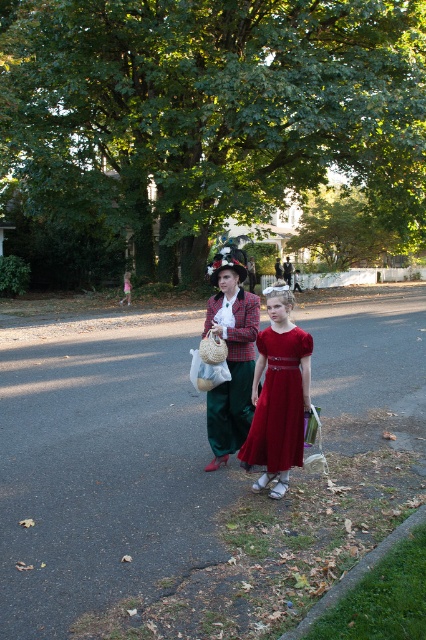
Question: Based on their relative distances, which object is nearer to the shiny satin dress at center?

Choices:
 (A) matte plaid coat at center
 (B) pink satin dress at center

Answer: (A)

Question: Is matte plaid coat at center positioned behind shiny satin dress at center?

Choices:
 (A) no
 (B) yes

Answer: (B)

Question: Which point is closer to the camera taking this photo?

Choices:
 (A) (278, 422)
 (B) (229, 328)

Answer: (A)

Question: Is matte plaid coat at center below shiny satin dress at center?

Choices:
 (A) yes
 (B) no

Answer: (B)

Question: Can you confirm if shiny satin dress at center is smaller than pink satin dress at center?

Choices:
 (A) yes
 (B) no

Answer: (A)

Question: Which of these objects is positioned closest to the pink satin dress at center?

Choices:
 (A) matte plaid coat at center
 (B) shiny satin dress at center

Answer: (A)